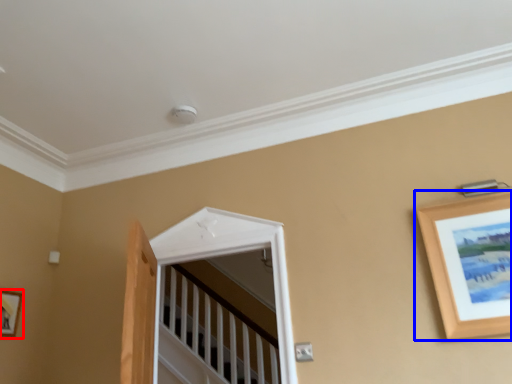
Question: Which object appears closest to the camera in this image, picture frame (highlighted by a red box) or picture frame (highlighted by a blue box)?

Choices:
 (A) picture frame
 (B) picture frame

Answer: (B)